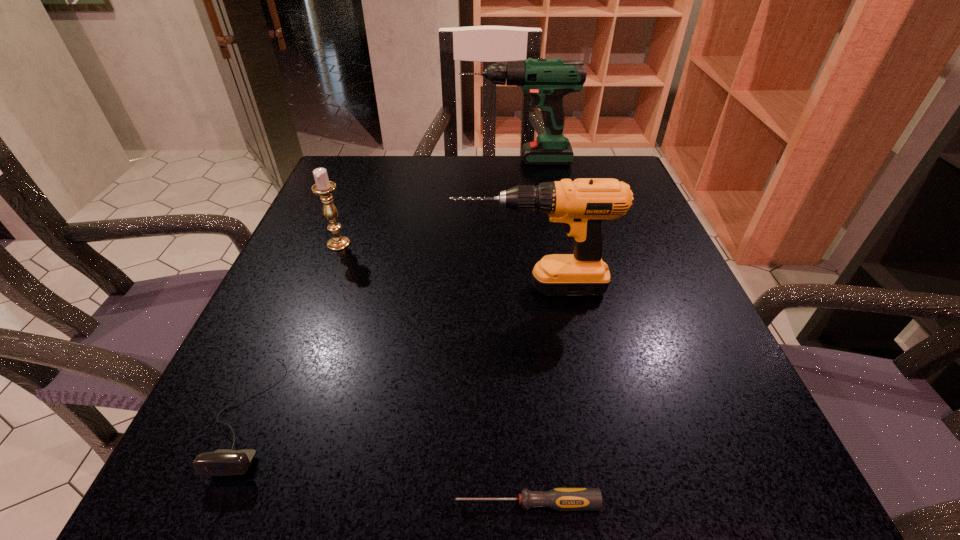
In the image, there is a desktop. At what (x,y) coordinates should I click in order to perform the action: click on free space at the far right corner. Please return your answer as a coordinate pair (x, y). Looking at the image, I should click on (616, 157).

The height and width of the screenshot is (540, 960). I want to click on vacant space at the near right corner of the desktop, so click(x=737, y=452).

In order to click on unoccupied area between the nearest object and the third nearest object in this screenshot , I will do `click(529, 395)`.

Locate an element on the screen. The width and height of the screenshot is (960, 540). empty space between the third nearest object and the screwdriver is located at coordinates (529, 395).

At what (x,y) coordinates should I click in order to perform the action: click on free space between the candle holder and the second shortest object. Please return your answer as a coordinate pair (x, y). Looking at the image, I should click on (294, 329).

Where is `free space between the farthest object and the second farthest object`? The height and width of the screenshot is (540, 960). free space between the farthest object and the second farthest object is located at coordinates (428, 202).

Identify the location of blank region between the farthest object and the nearer drill. (524, 224).

At what (x,y) coordinates should I click in order to perform the action: click on vacant space in between the fourth nearest object and the second shortest object. Please return your answer as a coordinate pair (x, y). Looking at the image, I should click on (294, 329).

Locate an element on the screen. The width and height of the screenshot is (960, 540). vacant area that lies between the second nearest object and the screwdriver is located at coordinates (388, 458).

Find the location of a particular element. Image resolution: width=960 pixels, height=540 pixels. free space between the shortest object and the farthest object is located at coordinates (522, 332).